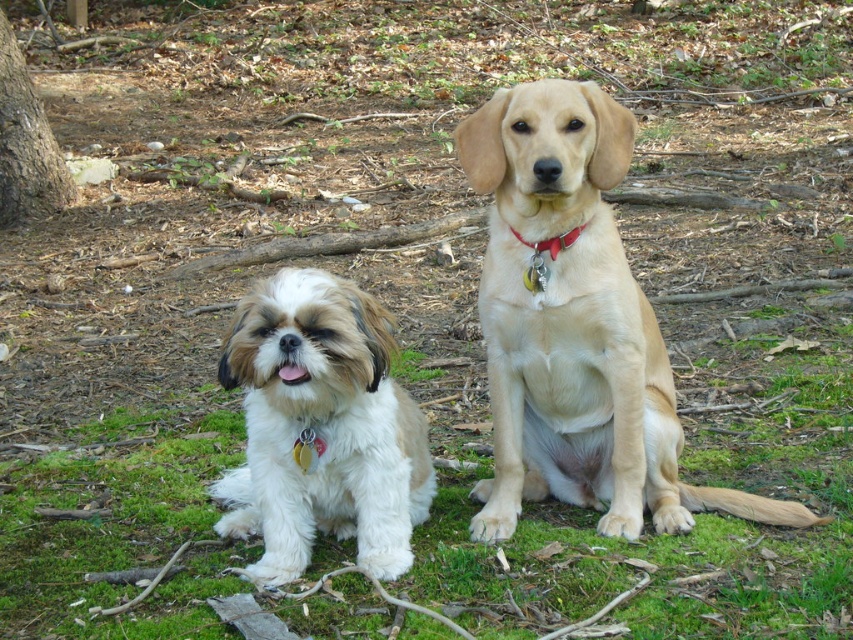
You are a dog owner who wants to place both dogs on the green soft grass at center. Since the red leather collar at center is attached to one of the dogs, will the grass be able to accommodate both dogs comfortably?

The green soft grass at center is bigger than the red leather collar at center, so the grass should be able to accommodate both dogs comfortably as the grass area is larger than the collar.

You are a photographer taking a picture of the two points in the image. Which point, point (596, 570) or point (627, 312), will appear larger in your photo?

Point (596, 570) is closer to the camera than point (627, 312), so it will appear larger in the photo.